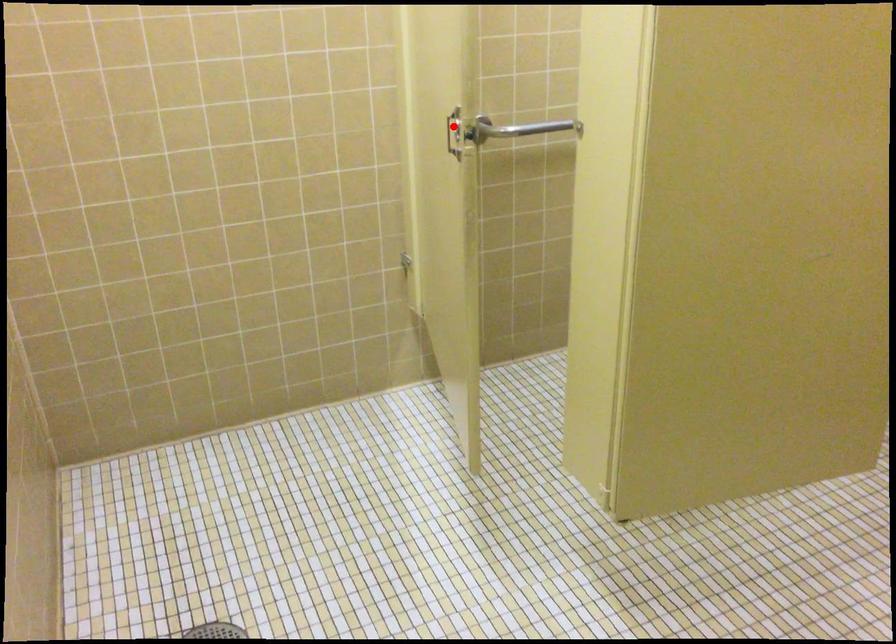
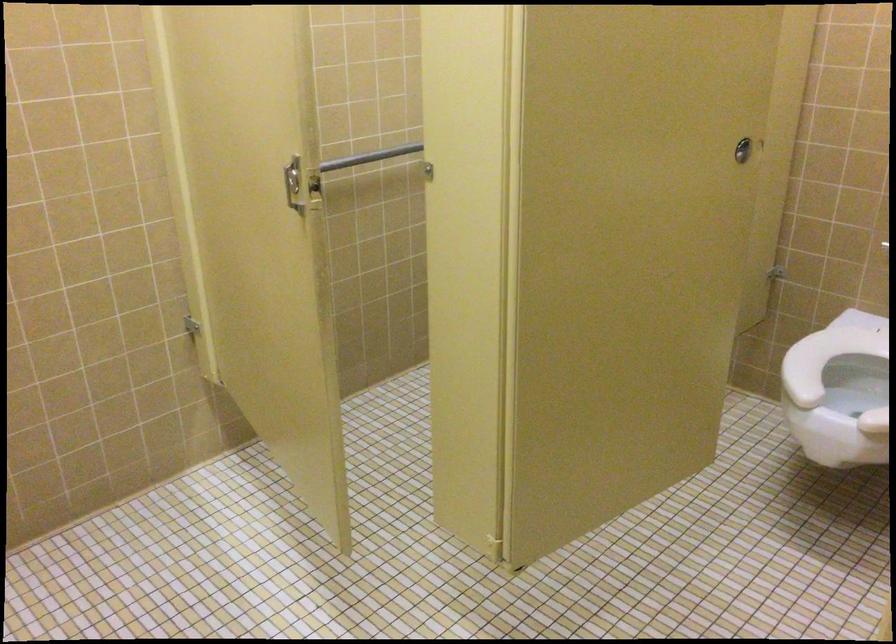
Question: I am providing you with two images of the same scene from different viewpoints. Given a red point in image1, look at the same physical point in image2. Is it:

Choices:
 (A) Closer to the viewpoint
 (B) Farther from the viewpoint

Answer: (A)